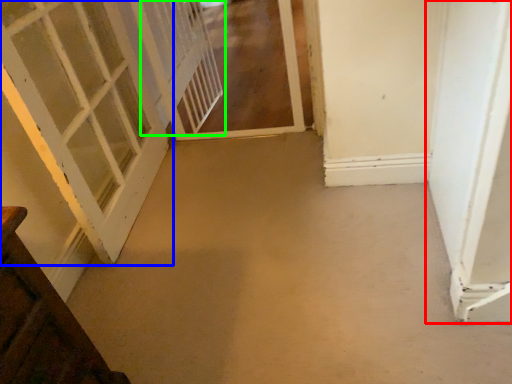
Question: Considering the real-world distances, which object is farthest from door (highlighted by a red box)? door (highlighted by a blue box) or screen door (highlighted by a green box)?

Choices:
 (A) door
 (B) screen door

Answer: (B)